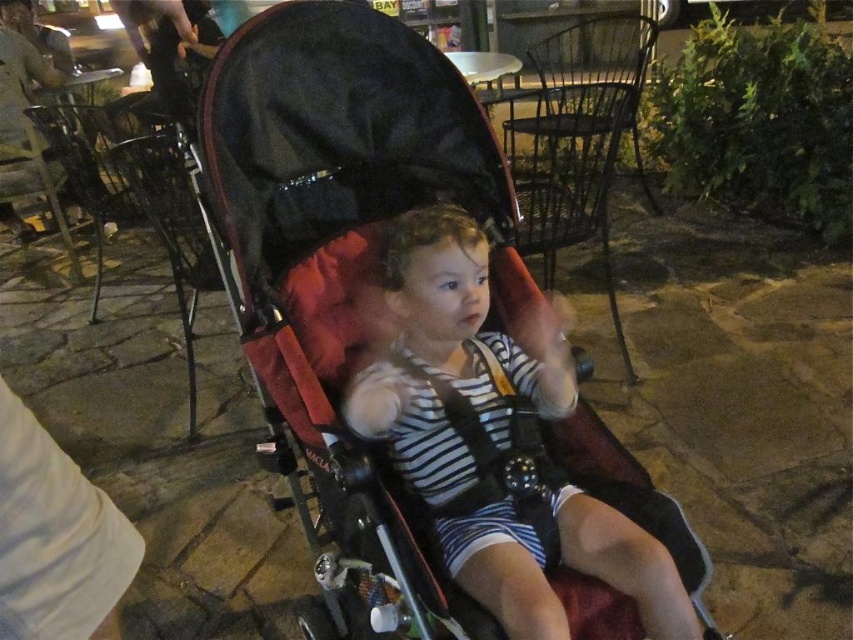
Question: Which point appears farthest from the camera in this image?

Choices:
 (A) pos(541,486)
 (B) pos(575,627)

Answer: (A)

Question: Is red fabric stroller at center positioned in front of striped fabric toddler at center?

Choices:
 (A) no
 (B) yes

Answer: (A)

Question: Can you confirm if red fabric stroller at center is thinner than striped fabric toddler at center?

Choices:
 (A) yes
 (B) no

Answer: (B)

Question: Which of the following is the farthest from the observer?

Choices:
 (A) 396,420
 (B) 418,97

Answer: (B)

Question: Can you confirm if red fabric stroller at center is bigger than striped fabric toddler at center?

Choices:
 (A) no
 (B) yes

Answer: (B)